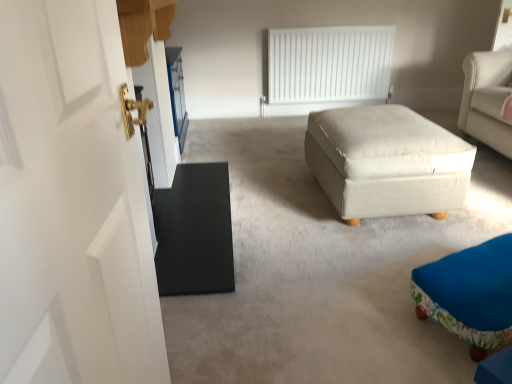
How much space does black matte table at left, marked as the first table in a left-to-right arrangement, occupy horizontally?

The width of black matte table at left, marked as the first table in a left-to-right arrangement, is 20.87 inches.

Identify the location of white fabric ottoman at center, positioned as the first table in right-to-left order. (387, 161).

Image resolution: width=512 pixels, height=384 pixels. What are the coordinates of `black matte door at left` in the screenshot? It's located at (321, 272).

Locate an element on the screen. Image resolution: width=512 pixels, height=384 pixels. white matte radiator at upper center is located at coordinates (329, 63).

Is white fabric ottoman at center, marked as the 2th table in a left-to-right arrangement, touching black matte table at left, the 2th table when ordered from right to left?

No, white fabric ottoman at center, marked as the 2th table in a left-to-right arrangement, is not making contact with black matte table at left, the 2th table when ordered from right to left.

Considering the relative positions of white fabric ottoman at center, positioned as the first table in right-to-left order, and black matte table at left, marked as the first table in a left-to-right arrangement, in the image provided, is white fabric ottoman at center, positioned as the first table in right-to-left order, to the left or to the right of black matte table at left, marked as the first table in a left-to-right arrangement,?

In the image, white fabric ottoman at center, positioned as the first table in right-to-left order, appears on the right side of black matte table at left, marked as the first table in a left-to-right arrangement.

In the image, is white fabric ottoman at center, positioned as the first table in right-to-left order, positioned in front of or behind black matte table at left, the 2th table when ordered from right to left?

Visually, white fabric ottoman at center, positioned as the first table in right-to-left order, is located behind black matte table at left, the 2th table when ordered from right to left.

Is white fabric ottoman at center, positioned as the first table in right-to-left order, bigger than black matte table at left, the 2th table when ordered from right to left?

Indeed, white fabric ottoman at center, positioned as the first table in right-to-left order, has a larger size compared to black matte table at left, the 2th table when ordered from right to left.

Is white fabric ottoman at center, positioned as the first table in right-to-left order, to the left of white matte radiator at upper center from the viewer's perspective?

No, white fabric ottoman at center, positioned as the first table in right-to-left order, is not to the left of white matte radiator at upper center.

The width and height of the screenshot is (512, 384). I want to click on radiator lying on the left of white fabric ottoman at center, marked as the 2th table in a left-to-right arrangement, so click(x=329, y=63).

Is white fabric ottoman at center, marked as the 2th table in a left-to-right arrangement, oriented towards white matte radiator at upper center?

No, white fabric ottoman at center, marked as the 2th table in a left-to-right arrangement, is not oriented towards white matte radiator at upper center.

Between black matte door at left and floral fabric ottoman at lower right, which one appears on the left side from the viewer's perspective?

Positioned to the left is black matte door at left.

Identify the location of plain below the floral fabric ottoman at lower right (from a real-world perspective). This screenshot has height=384, width=512. pos(321,272).

What's the angular difference between black matte door at left and floral fabric ottoman at lower right's facing directions?

They differ by 112 degrees in their facing directions.

Measure the distance between black matte door at left and floral fabric ottoman at lower right.

16.03 inches.

Is white matte radiator at upper center far away from floral fabric ottoman at lower right?

Absolutely, white matte radiator at upper center is distant from floral fabric ottoman at lower right.

Consider the image. Is white matte radiator at upper center positioned with its back to floral fabric ottoman at lower right?

No, white matte radiator at upper center is not facing the opposite direction of floral fabric ottoman at lower right.

Between white matte radiator at upper center and floral fabric ottoman at lower right, which one has larger size?

white matte radiator at upper center is bigger.

How many degrees apart are the facing directions of white matte radiator at upper center and floral fabric ottoman at lower right?

They differ by 158 degrees in their facing directions.

Can you confirm if black matte table at left, the 2th table when ordered from right to left, is bigger than black matte door at left?

No, black matte table at left, the 2th table when ordered from right to left, is not bigger than black matte door at left.

From a real-world perspective, is black matte table at left, the 2th table when ordered from right to left, above or below black matte door at left?

From a real-world perspective, black matte table at left, the 2th table when ordered from right to left, is physically above black matte door at left.

Does point (219, 166) lie in front of point (330, 284)?

No, (219, 166) is further to viewer.

Can we say black matte door at left lies outside white fabric ottoman at center, marked as the 2th table in a left-to-right arrangement?

Yes, black matte door at left is not within white fabric ottoman at center, marked as the 2th table in a left-to-right arrangement.

From the image's perspective, is black matte door at left above white fabric ottoman at center, positioned as the first table in right-to-left order?

No.

Could you tell me if black matte door at left is facing white fabric ottoman at center, marked as the 2th table in a left-to-right arrangement?

No, black matte door at left is not aimed at white fabric ottoman at center, marked as the 2th table in a left-to-right arrangement.

Is point (510, 313) positioned behind point (441, 142)?

That is False.

Considering the relative sizes of floral fabric ottoman at lower right and white fabric ottoman at center, marked as the 2th table in a left-to-right arrangement, in the image provided, is floral fabric ottoman at lower right smaller than white fabric ottoman at center, marked as the 2th table in a left-to-right arrangement,?

Correct, floral fabric ottoman at lower right occupies less space than white fabric ottoman at center, marked as the 2th table in a left-to-right arrangement.

Can you see floral fabric ottoman at lower right touching white fabric ottoman at center, positioned as the first table in right-to-left order?

No.

From the image's perspective, which object appears higher, floral fabric ottoman at lower right or white fabric ottoman at center, positioned as the first table in right-to-left order?

white fabric ottoman at center, positioned as the first table in right-to-left order, is shown above in the image.

I want to click on table below the white fabric ottoman at center, positioned as the first table in right-to-left order (from the image's perspective), so click(x=194, y=231).

This screenshot has height=384, width=512. Identify the location of radiator lying on the left of white fabric ottoman at center, marked as the 2th table in a left-to-right arrangement. tap(329, 63).

Estimate the real-world distances between objects in this image. Which object is further from black matte table at left, marked as the first table in a left-to-right arrangement, black matte door at left or white matte radiator at upper center?

Based on the image, white matte radiator at upper center appears to be further to black matte table at left, marked as the first table in a left-to-right arrangement.

Based on their spatial positions, is white fabric ottoman at center, marked as the 2th table in a left-to-right arrangement, or white matte radiator at upper center further from black matte door at left?

white matte radiator at upper center.

Estimate the real-world distances between objects in this image. Which object is further from white matte radiator at upper center, black matte table at left, the 2th table when ordered from right to left, or black matte door at left?

black matte table at left, the 2th table when ordered from right to left.

Looking at the image, which one is located closer to black matte door at left, floral fabric ottoman at lower right or black matte table at left, marked as the first table in a left-to-right arrangement?

The object closer to black matte door at left is floral fabric ottoman at lower right.

Considering their positions, is black matte door at left positioned closer to black matte table at left, the 2th table when ordered from right to left, than floral fabric ottoman at lower right?

black matte door at left is closer to black matte table at left, the 2th table when ordered from right to left.

Based on the photo, considering their positions, is black matte table at left, the 2th table when ordered from right to left, positioned closer to floral fabric ottoman at lower right than black matte door at left?

The object closer to floral fabric ottoman at lower right is black matte door at left.

In the scene shown: Which object lies nearer to the anchor point white matte radiator at upper center, floral fabric ottoman at lower right or black matte door at left?

black matte door at left is closer to white matte radiator at upper center.

Looking at the image, which one is located closer to black matte door at left, white matte radiator at upper center or white fabric ottoman at center, marked as the 2th table in a left-to-right arrangement?

white fabric ottoman at center, marked as the 2th table in a left-to-right arrangement, lies closer to black matte door at left than the other object.

This screenshot has width=512, height=384. Identify the location of table between black matte table at left, marked as the first table in a left-to-right arrangement, and black matte door at left. (387, 161).

What are the coordinates of `furniture positioned between black matte door at left and white fabric ottoman at center, marked as the 2th table in a left-to-right arrangement, from near to far` in the screenshot? It's located at [469, 294].

Find the location of a particular element. This screenshot has width=512, height=384. plain between black matte table at left, marked as the first table in a left-to-right arrangement, and floral fabric ottoman at lower right, in the horizontal direction is located at coordinates (321, 272).

At what (x,y) coordinates should I click in order to perform the action: click on furniture positioned between black matte door at left and white matte radiator at upper center from near to far. Please return your answer as a coordinate pair (x, y). Looking at the image, I should click on (469, 294).